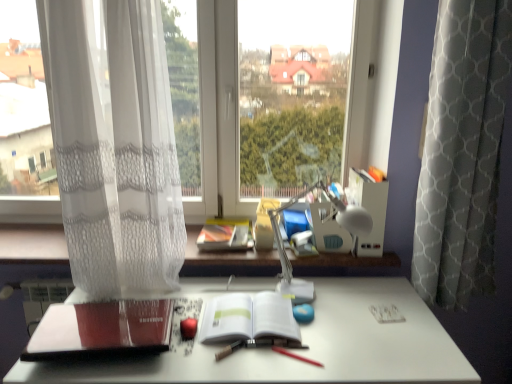
Question: Considering the relative sizes of white matte desk at center and white sheer curtain at left, positioned as the first curtain in left-to-right order, in the image provided, is white matte desk at center thinner than white sheer curtain at left, positioned as the first curtain in left-to-right order,?

Choices:
 (A) yes
 (B) no

Answer: (B)

Question: Considering the relative sizes of white matte desk at center and white sheer curtain at left, the second curtain from the right, in the image provided, is white matte desk at center shorter than white sheer curtain at left, the second curtain from the right,?

Choices:
 (A) no
 (B) yes

Answer: (B)

Question: From a real-world perspective, does white matte desk at center sit lower than white sheer curtain at left, the second curtain from the right?

Choices:
 (A) yes
 (B) no

Answer: (A)

Question: Would you say white matte desk at center contains white sheer curtain at left, positioned as the first curtain in left-to-right order?

Choices:
 (A) no
 (B) yes

Answer: (A)

Question: Can you confirm if white matte desk at center is positioned to the left of white sheer curtain at left, the second curtain from the right?

Choices:
 (A) yes
 (B) no

Answer: (B)

Question: Is white sheer curtain at left, positioned as the first curtain in left-to-right order, wider or thinner than gray textured curtain at right, which is counted as the second curtain, starting from the left?

Choices:
 (A) wide
 (B) thin

Answer: (A)

Question: Looking at the image, does white sheer curtain at left, positioned as the first curtain in left-to-right order, seem bigger or smaller compared to gray textured curtain at right, marked as the 1th curtain in a right-to-left arrangement?

Choices:
 (A) big
 (B) small

Answer: (B)

Question: Does point (133, 144) appear closer or farther from the camera than point (436, 256)?

Choices:
 (A) closer
 (B) farther

Answer: (A)

Question: From the image's perspective, is white sheer curtain at left, positioned as the first curtain in left-to-right order, above or below gray textured curtain at right, marked as the 1th curtain in a right-to-left arrangement?

Choices:
 (A) below
 (B) above

Answer: (B)

Question: From a real-world perspective, relative to white paper at center, placed as the 1th paperback book when sorted from right to left, is white sheer curtain at left, the second curtain from the right, vertically above or below?

Choices:
 (A) above
 (B) below

Answer: (A)

Question: From the image's perspective, is white sheer curtain at left, positioned as the first curtain in left-to-right order, positioned above or below white paper at center, marked as the 2th paperback book in a left-to-right arrangement?

Choices:
 (A) below
 (B) above

Answer: (B)

Question: Choose the correct answer: Is white sheer curtain at left, positioned as the first curtain in left-to-right order, inside white paper at center, placed as the 1th paperback book when sorted from right to left, or outside it?

Choices:
 (A) outside
 (B) inside

Answer: (A)

Question: Does point (156, 59) appear closer or farther from the camera than point (244, 326)?

Choices:
 (A) farther
 (B) closer

Answer: (A)

Question: From the image's perspective, is smooth red crayon at center positioned above or below red matte book at lower left, positioned as the 1th paperback book in left-to-right order?

Choices:
 (A) above
 (B) below

Answer: (B)

Question: From a real-world perspective, relative to red matte book at lower left, marked as the 2th paperback book in a right-to-left arrangement, is smooth red crayon at center vertically above or below?

Choices:
 (A) below
 (B) above

Answer: (A)